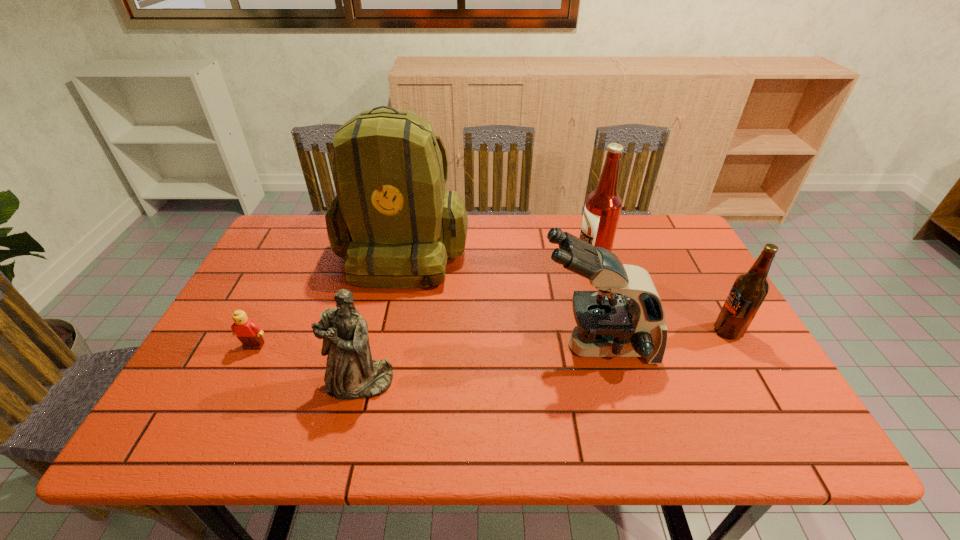
At what (x,y) coordinates should I click in order to perform the action: click on free spot between the beer bottle and the leftmost object. Please return your answer as a coordinate pair (x, y). The width and height of the screenshot is (960, 540). Looking at the image, I should click on (491, 339).

In order to click on free space that is in between the tallest object and the microscope in this screenshot , I will do point(499,298).

The height and width of the screenshot is (540, 960). In order to click on free space between the Lego and the microscope in this screenshot , I will do `click(425, 346)`.

The width and height of the screenshot is (960, 540). Identify the location of empty space between the leftmost object and the rightmost object. (491, 339).

Identify the location of free spot between the leftmost object and the figurine. (307, 364).

Where is `free space between the backpack and the alcohol`? The width and height of the screenshot is (960, 540). free space between the backpack and the alcohol is located at coordinates (497, 255).

You are a GUI agent. You are given a task and a screenshot of the screen. Output one action in this format:
    pyautogui.click(x=<x>, y=<y>)
    Task: Click on the vacant area between the beer bottle and the figurine
    The image size is (960, 540).
    Given the screenshot: What is the action you would take?
    pyautogui.click(x=544, y=357)

At what (x,y) coordinates should I click in order to perform the action: click on object that is the closest to the leftmost object. Please return your answer as a coordinate pair (x, y). The height and width of the screenshot is (540, 960). Looking at the image, I should click on (351, 374).

Find the location of a particular element. This screenshot has width=960, height=540. the fourth closest object to the tallest object is located at coordinates (603, 206).

You are a GUI agent. You are given a task and a screenshot of the screen. Output one action in this format:
    pyautogui.click(x=<x>, y=<y>)
    Task: Click on the free space that satisfies the following two spatial constraints: 1. on the label of the rightmost object; 2. on the face of the shortest object
    The width and height of the screenshot is (960, 540).
    Given the screenshot: What is the action you would take?
    pyautogui.click(x=736, y=346)